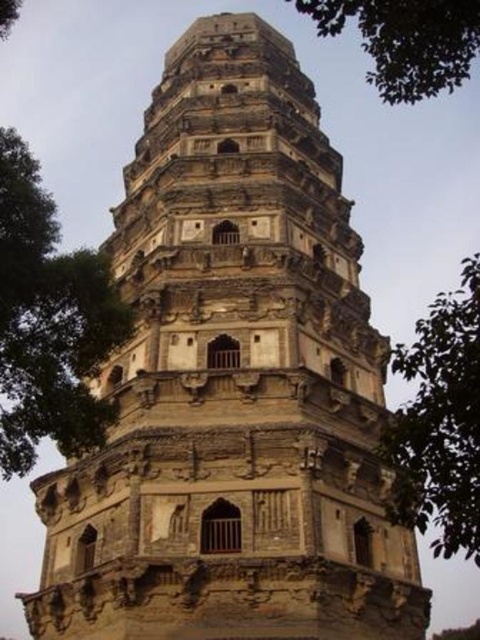
You are standing in front of the multi tiered stone tower and want to take a photo. You notice two points on the tower marked as point 1 and point 2. If point 1 is at coordinate (36,346) and point 2 is at (418,525), which point is closer to your camera lens?

Point 1 at coordinate (36,346) is closer to the camera lens than point 2 at (418,525) because it is further to the camera according to the description.

Looking at this image, you are a park ranger planning to install a new bench between the two green leafy trees. The bench requires a minimum of 3 meters of space between the trees to be placed. Can you determine if there is enough space between the green leafy tree at left and the green leafy tree at right for the bench?

The green leafy tree at left and the green leafy tree at right are 30.79 meters apart, which is more than the required 3 meters, so there is enough space to place the bench between them.